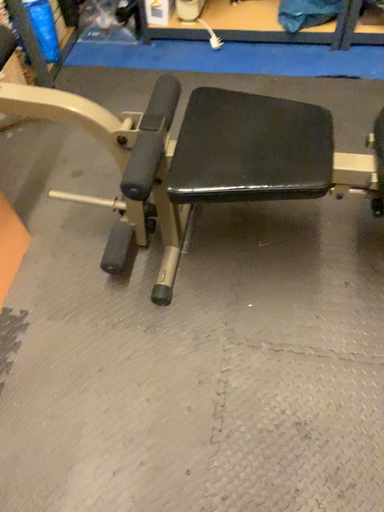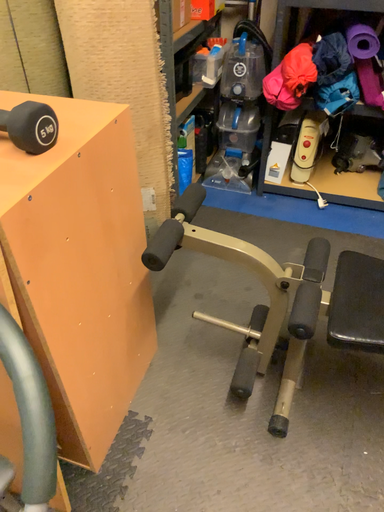
Question: How did the camera likely rotate when shooting the video?

Choices:
 (A) rotated upward
 (B) rotated downward

Answer: (A)